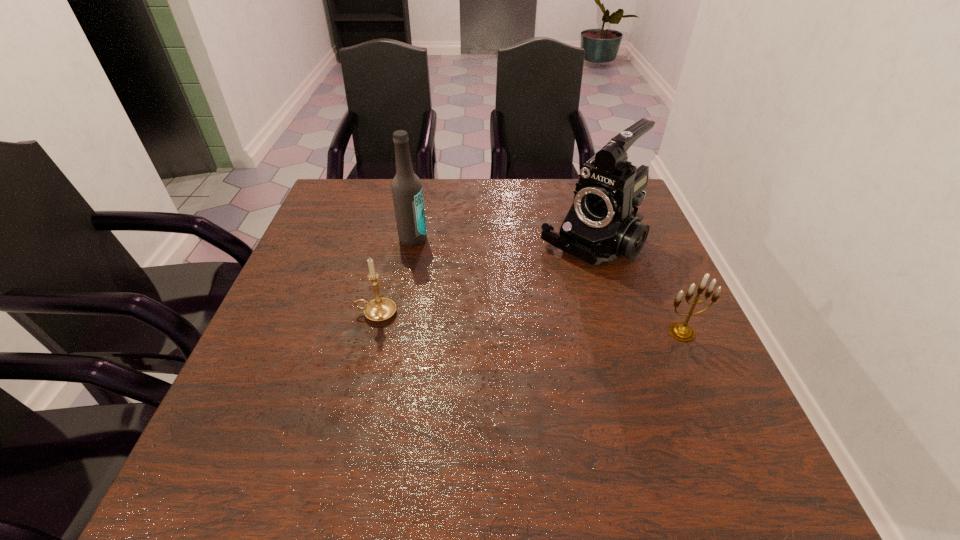
The height and width of the screenshot is (540, 960). I want to click on free spot at the left edge of the desktop, so click(x=320, y=379).

The width and height of the screenshot is (960, 540). Find the location of `free region at the right edge`. free region at the right edge is located at coordinates (619, 276).

Find the location of `vacant region at the far left corner of the desktop`. vacant region at the far left corner of the desktop is located at coordinates (366, 201).

Where is `free spot between the left candelabrum and the beer bottle`? free spot between the left candelabrum and the beer bottle is located at coordinates (395, 276).

Where is `vacant area that lies between the left candelabrum and the camcorder`? The width and height of the screenshot is (960, 540). vacant area that lies between the left candelabrum and the camcorder is located at coordinates (483, 279).

Find the location of a particular element. unoccupied position between the right candelabrum and the camcorder is located at coordinates (636, 288).

Locate an element on the screen. Image resolution: width=960 pixels, height=540 pixels. free spot between the beer bottle and the right candelabrum is located at coordinates (547, 286).

Identify the location of empty space between the right candelabrum and the camcorder. This screenshot has height=540, width=960. (636, 288).

At what (x,y) coordinates should I click in order to perform the action: click on free space that is in between the beer bottle and the camcorder. Please return your answer as a coordinate pair (x, y). Looking at the image, I should click on (501, 241).

Find the location of a particular element. This screenshot has width=960, height=540. free space that is in between the right candelabrum and the camcorder is located at coordinates (636, 288).